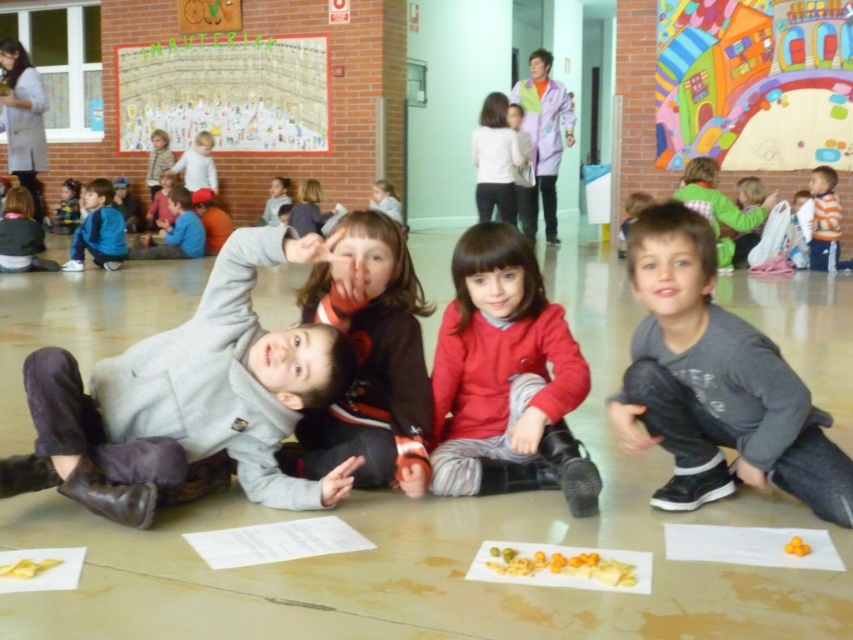
You are a photographer trying to capture both the gray cotton sweatshirt at center and the matte gray hoodie at upper right in a single shot. Based on their positions, which one will appear larger in the photo?

The gray cotton sweatshirt at center will appear larger in the photo because it is closer to the viewer than the matte gray hoodie at upper right.

You are a photographer trying to capture a shot of both the gray cotton sweatshirt at center and the matte gray hoodie at upper right. Since you want both items to be clearly visible in the frame, which object should you focus on first to ensure proper focus, considering their positions and sizes?

The gray cotton sweatshirt at center has a lesser height compared to the matte gray hoodie at upper right, so you should focus on the matte gray hoodie at upper right first to ensure both are in focus since it is taller and might be further away.

You need to place a rectangular box that is 1.5 meters wide between the blue fleece jacket at left and the orange striped shirt at right. Based on their widths, will the box fit between them?

The blue fleece jacket at left is wider than the orange striped shirt at right. However, the question is about fitting a box between them, which depends on the distance between the two objects, not their widths. The provided information only states their widths relative to each other, not the space between them. Therefore, it is impossible to determine if the box will fit based on the given details.